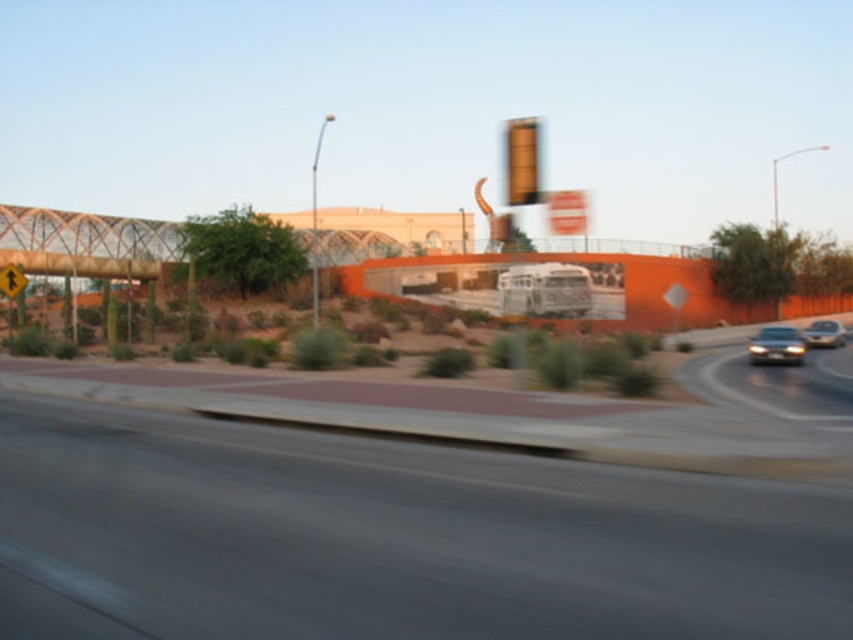
You are driving a car and approaching the matte orange traffic light at upper center and the silver metallic sedan at right. Which object appears taller in the image?

The matte orange traffic light at upper center appears taller than the silver metallic sedan at right in the image.

You are driving a car and see the gray asphalt highway at center and the shiny silver sedan at right. Which object is nearer to you as you drive?

The gray asphalt highway at center is closer to the viewer than the shiny silver sedan at right.

You are driving a silver metallic sedan at right and want to safely navigate the gray asphalt highway at center. Considering the highway width, will you have enough space to maneuver without crossing into the adjacent lane?

The gray asphalt highway at center has a width less than the silver metallic sedan at right, so you may not have enough space to maneuver safely without crossing into the adjacent lane. Proceed with caution or consider an alternative route.